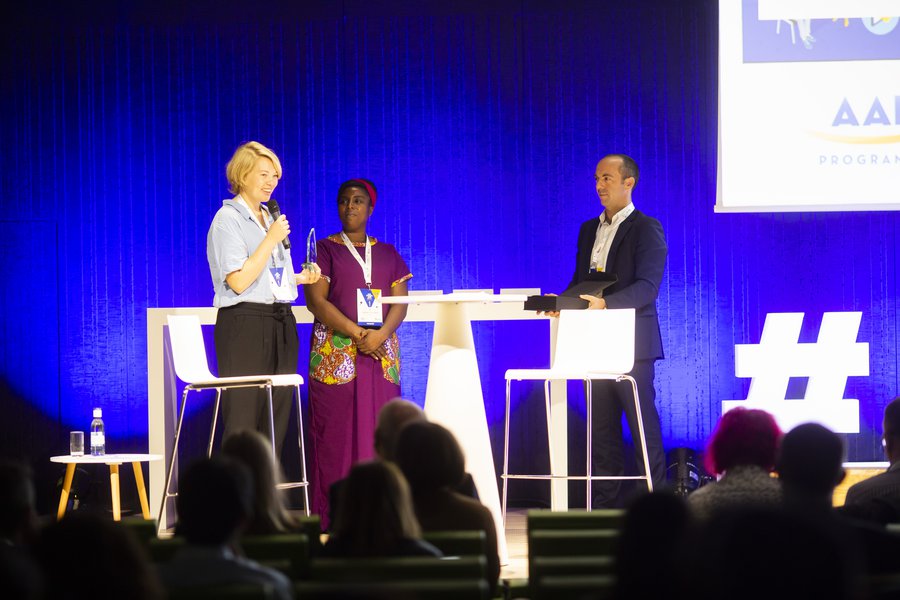
You are a GUI agent. You are given a task and a screenshot of the screen. Output one action in this format:
    pyautogui.click(x=<x>, y=<y>)
    Task: Click on the curtain
    The height and width of the screenshot is (600, 900).
    Given the screenshot: What is the action you would take?
    pyautogui.click(x=532, y=198), pyautogui.click(x=95, y=237), pyautogui.click(x=364, y=119), pyautogui.click(x=166, y=122), pyautogui.click(x=772, y=282)